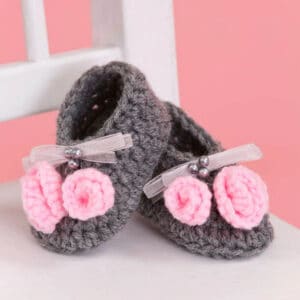
Image resolution: width=300 pixels, height=300 pixels. Identify the location of decorative pink flower. point(228,206).